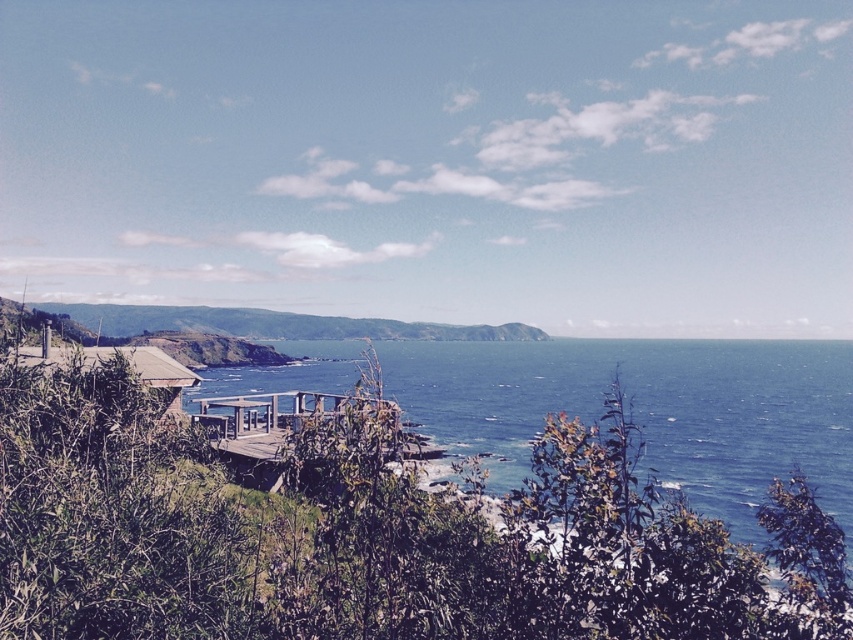
Question: Does blue water at lower center have a lesser width compared to wooden hut at lower left?

Choices:
 (A) no
 (B) yes

Answer: (A)

Question: Which is farther from the wooden hut at lower left?

Choices:
 (A) wooden deck at center
 (B) green grassy hillside at center

Answer: (B)

Question: Among these points, which one is farthest from the camera?

Choices:
 (A) (206, 372)
 (B) (132, 353)

Answer: (A)

Question: Among these objects, which one is farthest from the camera?

Choices:
 (A) wooden deck at center
 (B) wooden hut at lower left
 (C) green grassy hillside at center
 (D) blue water at lower center

Answer: (C)

Question: Can you confirm if green grassy hillside at center is bigger than wooden deck at center?

Choices:
 (A) yes
 (B) no

Answer: (A)

Question: Is green grassy hillside at center wider than wooden hut at lower left?

Choices:
 (A) yes
 (B) no

Answer: (A)